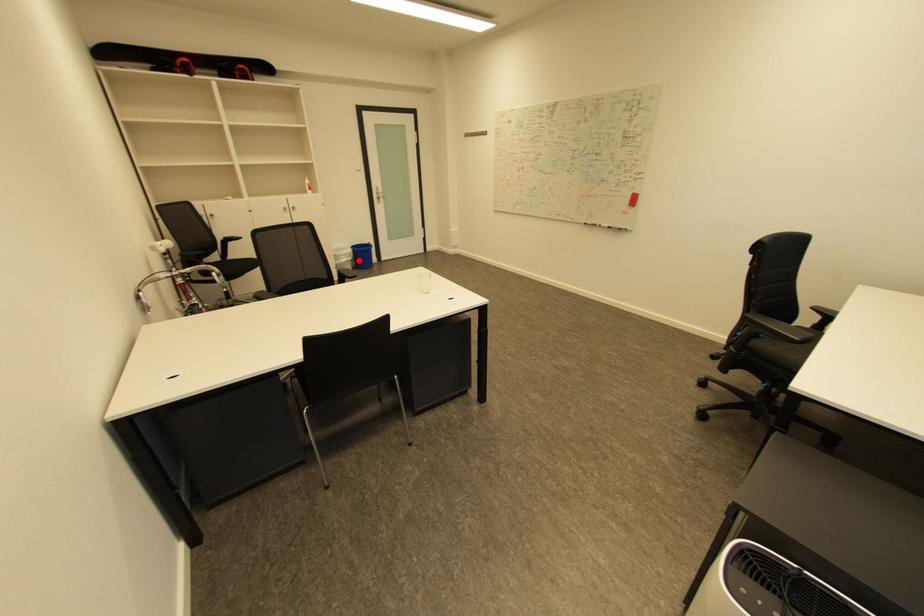
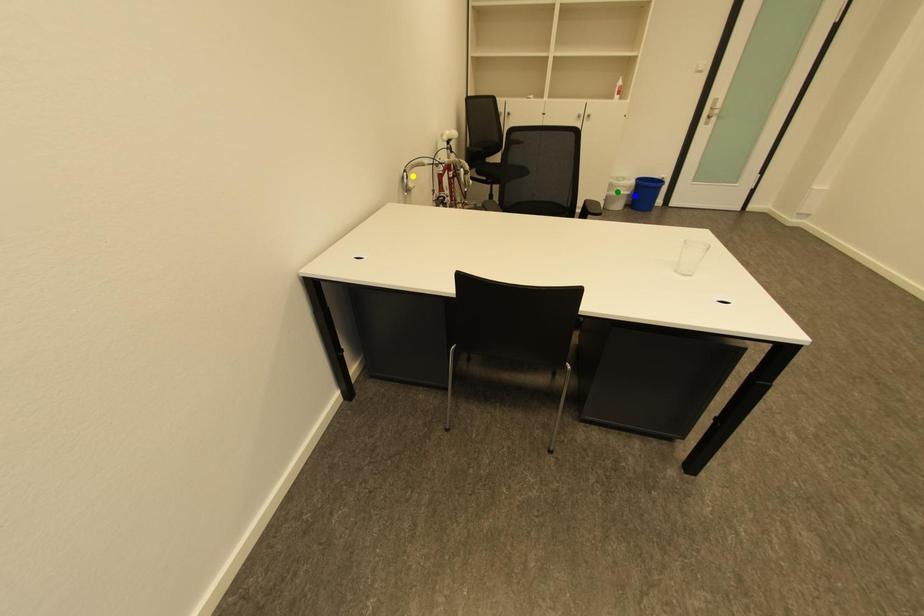
Question: I am providing you with two images of the same scene from different viewpoints. A red point is marked on the first image. You are given multiple points on the second image. In image 2, which mark is for the same physical point as the one in image 1?

Choices:
 (A) yellow point
 (B) blue point
 (C) green point

Answer: (B)